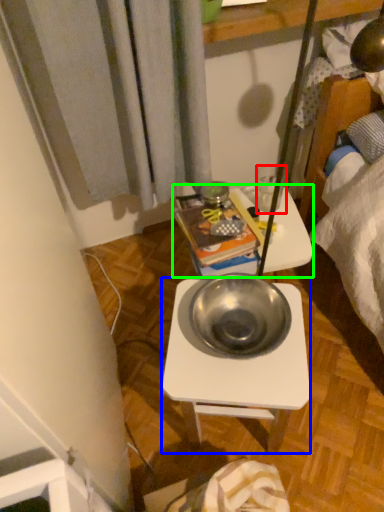
Question: Based on their relative distances, which object is nearer to coffee cup (highlighted by a red box)? Choose from desk (highlighted by a blue box) and table (highlighted by a green box).

Choices:
 (A) desk
 (B) table

Answer: (B)